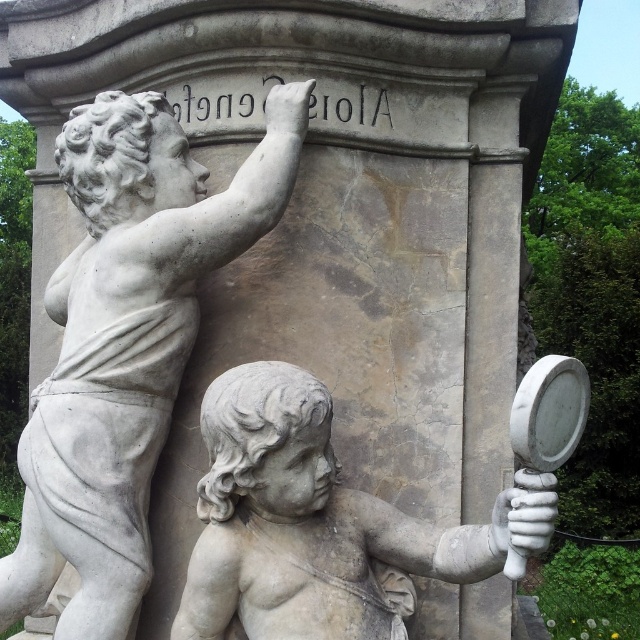
Does white marble cherub at upper left have a lesser width compared to white marble cherub at lower center?

Yes, white marble cherub at upper left is thinner than white marble cherub at lower center.

Is point (77, 172) less distant than point (328, 500)?

No, (77, 172) is further to viewer.

Is point (100, 205) behind point (296, 483)?

Yes, point (100, 205) is farther from viewer.

I want to click on white marble cherub at upper left, so click(125, 340).